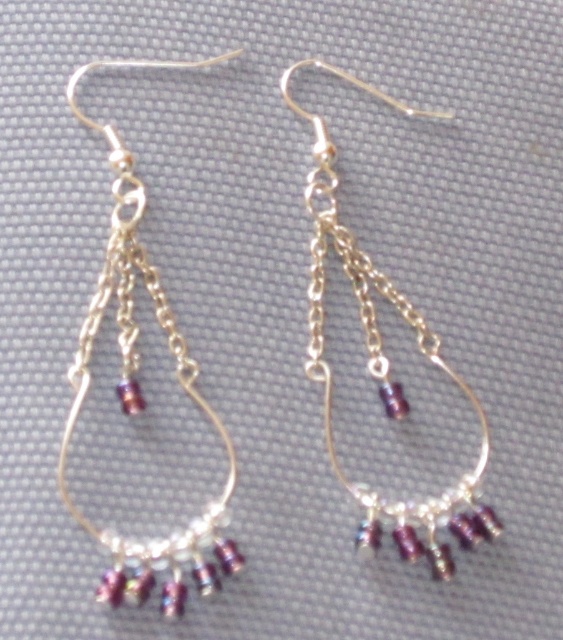
What is the material of the object located at point (140,388)?

The object at point (140,388) is matte silver chain at left.